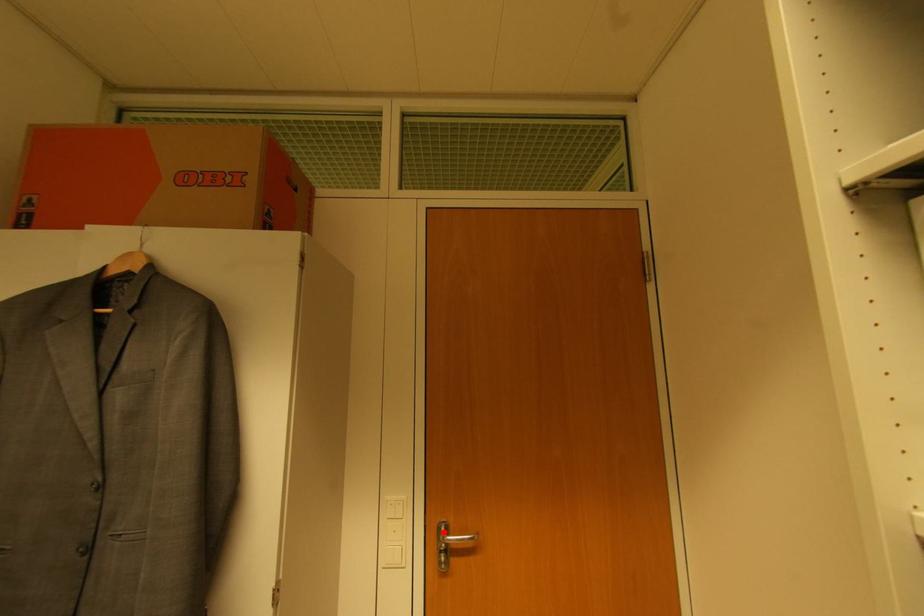
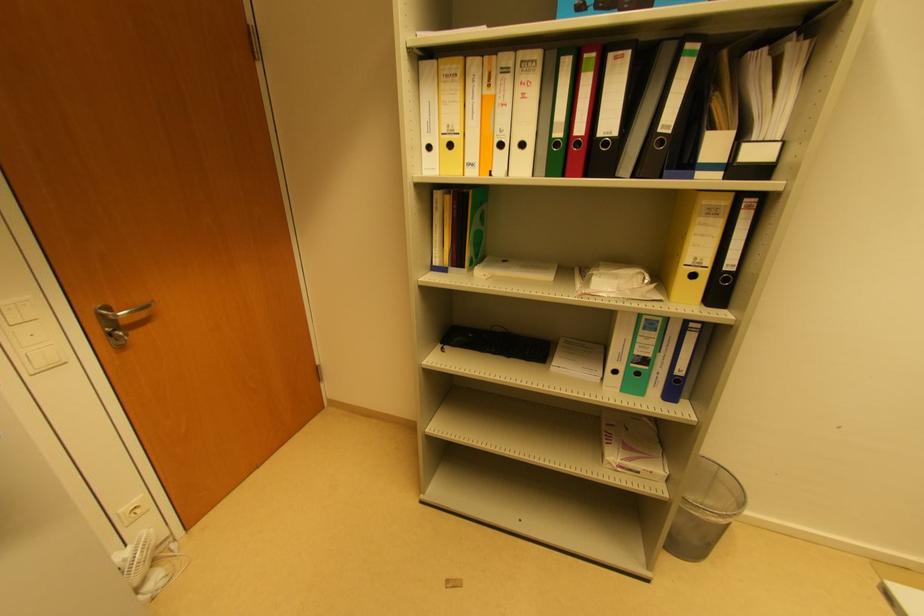
Find the pixel in the second image that matches the highlighted location in the first image.

(106, 314)